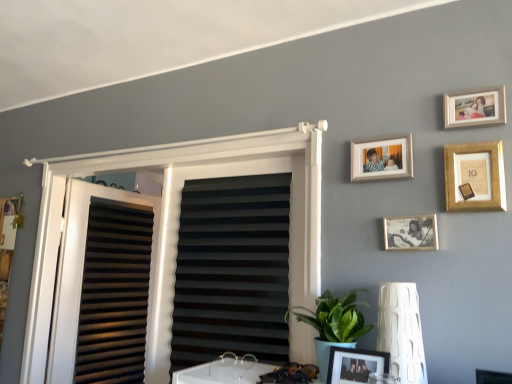
Question: Is white plastic window frame at upper center spatially inside white textured lamp at lower right, or outside of it?

Choices:
 (A) outside
 (B) inside

Answer: (A)

Question: From the image's perspective, is white plastic window frame at upper center located above or below white textured lamp at lower right?

Choices:
 (A) above
 (B) below

Answer: (A)

Question: Estimate the real-world distances between objects in this image. Which object is closer to the metallic silver photo frame at center-right, which appears as the 4th picture frame when viewed from the top?

Choices:
 (A) black matte window blind at center
 (B) white matte curtain at left
 (C) matte black picture frame at lower center, the fifth picture frame positioned from the top
 (D) gold metallic picture frame at upper right, arranged as the third picture frame when ordered from the bottom
 (E) white textured lamp at lower right

Answer: (D)

Question: Estimate the real-world distances between objects in this image. Which object is farther from the white plastic window frame at upper center?

Choices:
 (A) gold metallic photo frame at upper right, which ranks as the 5th picture frame in bottom-to-top order
 (B) metallic silver photo frame at center-right, the second picture frame ordered from the bottom
 (C) green leafy plant at lower center
 (D) white textured lamp at lower right
 (E) white matte curtain at left

Answer: (A)